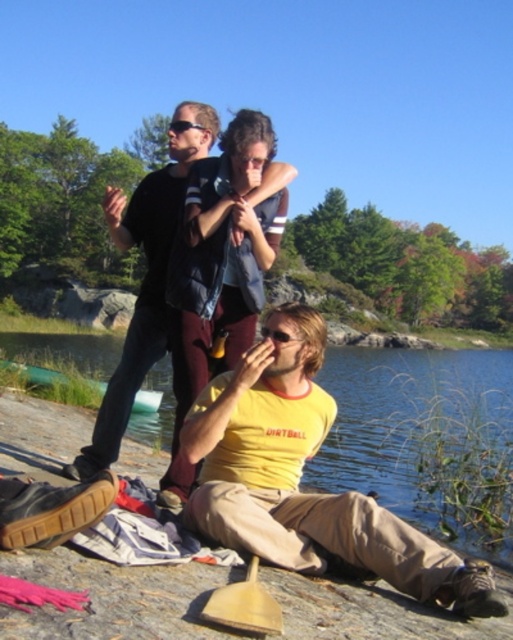
You are a fashion designer observing the man in the scene. You need to create a new outfit that matches the proportions of his current clothing. Which clothing item has a smaller width between the yellow cotton shirt at center and the dark blue jeans at upper center?

The yellow cotton shirt at center has a smaller width compared to the dark blue jeans at upper center.

You are a fashion designer observing the outdoor scene. You notice the yellow cotton shirt at center and the dark blue jeans at upper center. Which clothing item appears smaller in the image?

The yellow cotton shirt at center appears smaller than the dark blue jeans at upper center in the image.